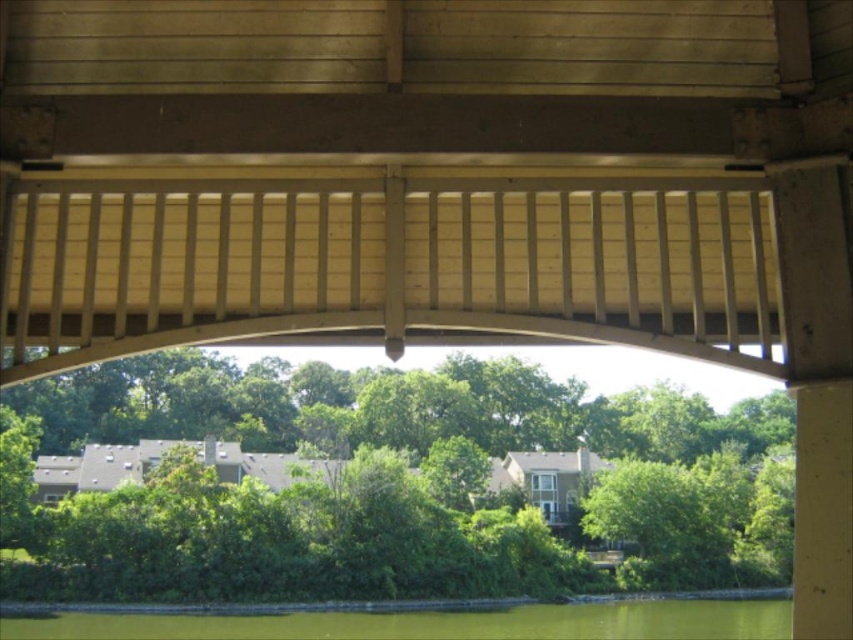
Question: Does wooden bridge at center lie in front of green water at lower center?

Choices:
 (A) no
 (B) yes

Answer: (B)

Question: Is wooden bridge at center smaller than green water at lower center?

Choices:
 (A) yes
 (B) no

Answer: (A)

Question: Can you confirm if wooden bridge at center is positioned above green water at lower center?

Choices:
 (A) no
 (B) yes

Answer: (B)